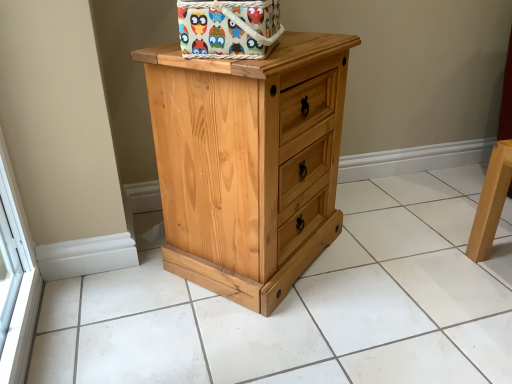
Where is `space that is in front of natural wood chest of drawers at center`? Image resolution: width=512 pixels, height=384 pixels. space that is in front of natural wood chest of drawers at center is located at coordinates (265, 336).